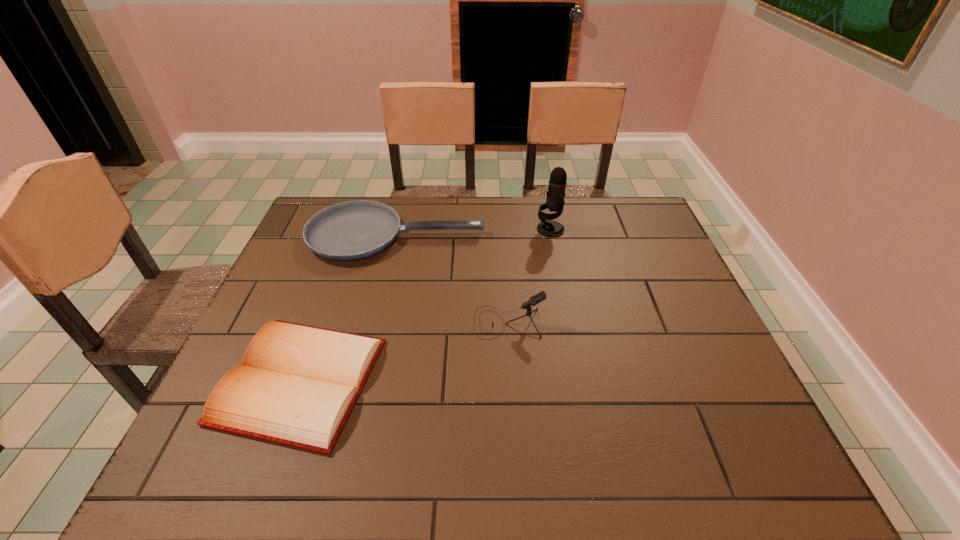
Where is `free spot between the frying pan and the taller microphone`? free spot between the frying pan and the taller microphone is located at coordinates (473, 233).

Locate an element on the screen. free point between the third shortest object and the Bible is located at coordinates (404, 352).

The height and width of the screenshot is (540, 960). Identify the location of vacant area between the left microphone and the Bible. (404, 352).

Where is `vacant region between the nearer microphone and the farther microphone`? The height and width of the screenshot is (540, 960). vacant region between the nearer microphone and the farther microphone is located at coordinates (529, 276).

This screenshot has height=540, width=960. What are the coordinates of `vacant region between the nearer microphone and the farther microphone` in the screenshot? It's located at (529, 276).

I want to click on object that stands as the closest to the Bible, so click(x=541, y=296).

Locate which object is the third closest to the taller microphone. Please provide its 2D coordinates. Your answer should be formatted as a tuple, i.e. [(x, y)], where the tuple contains the x and y coordinates of a point satisfying the conditions above.

[(297, 385)]

Find the location of a particular element. The image size is (960, 540). blank area in the image that satisfies the following two spatial constraints: 1. on the stand of the shorter microphone; 2. on the front side of the Bible is located at coordinates (512, 381).